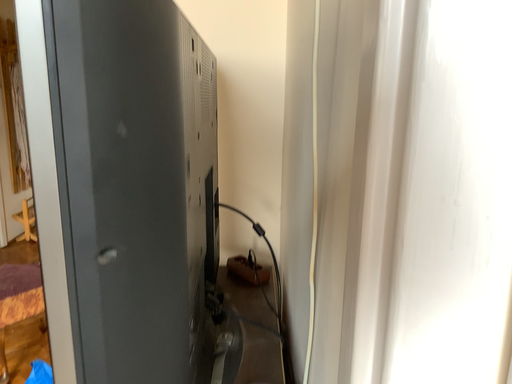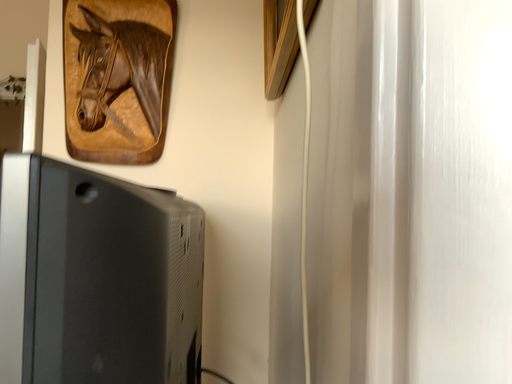
Question: Which way did the camera rotate in the video?

Choices:
 (A) rotated downward
 (B) rotated upward

Answer: (B)